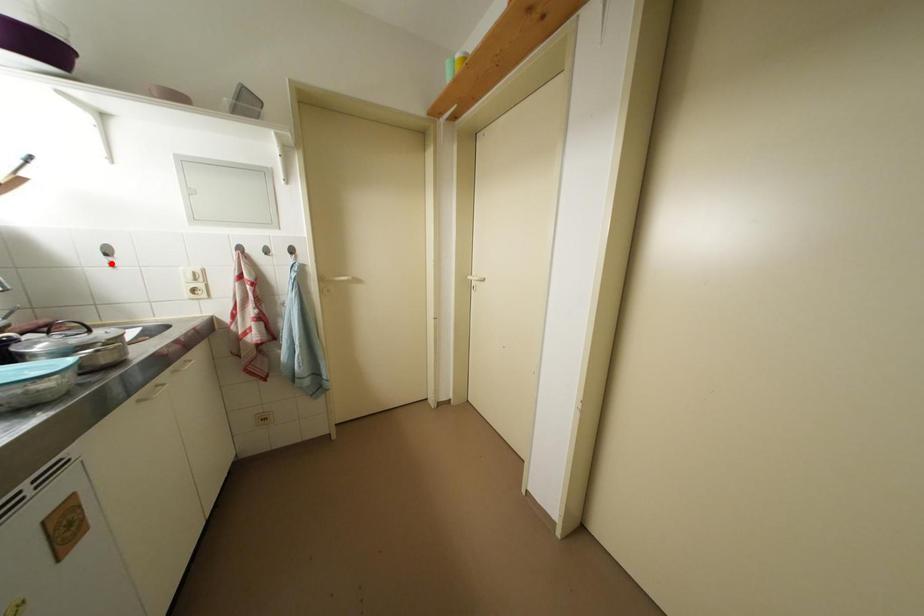
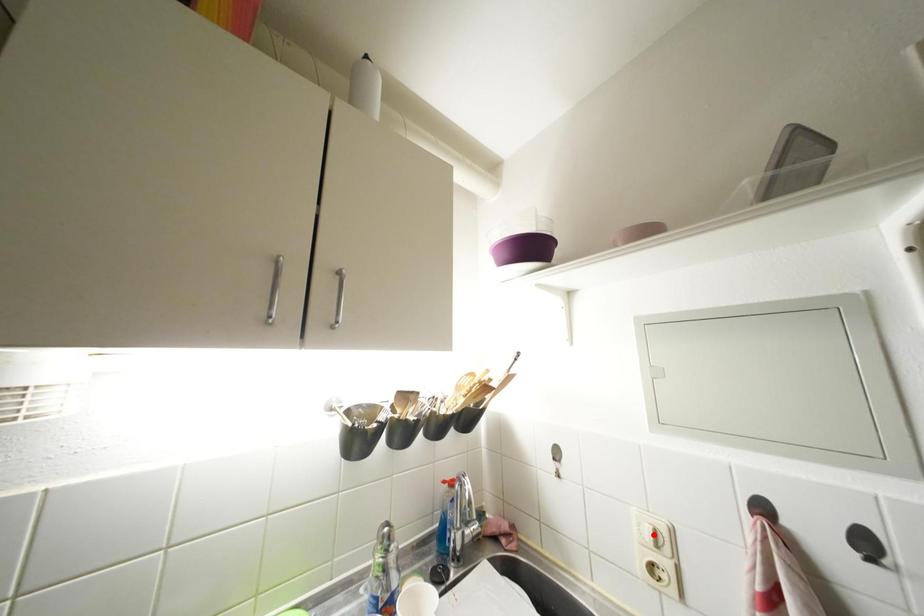
I am providing you with two images of the same scene from different viewpoints. A red point is marked on the first image and another point is marked on the second image. Is the red point in image1 aligned with the point shown in image2?

No